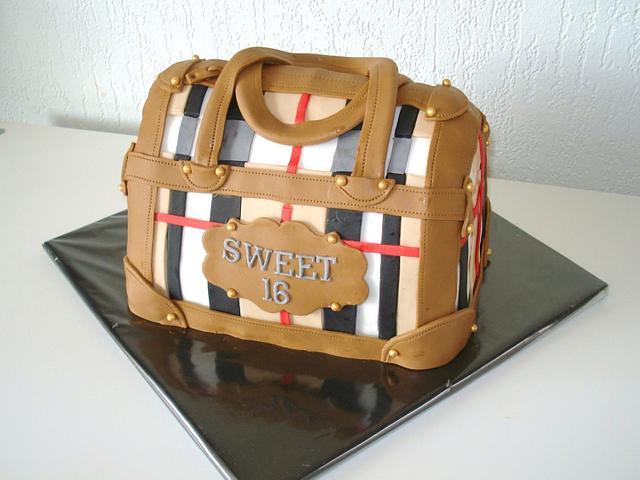
Image resolution: width=640 pixels, height=480 pixels. Identify the location of wall. (505, 91).